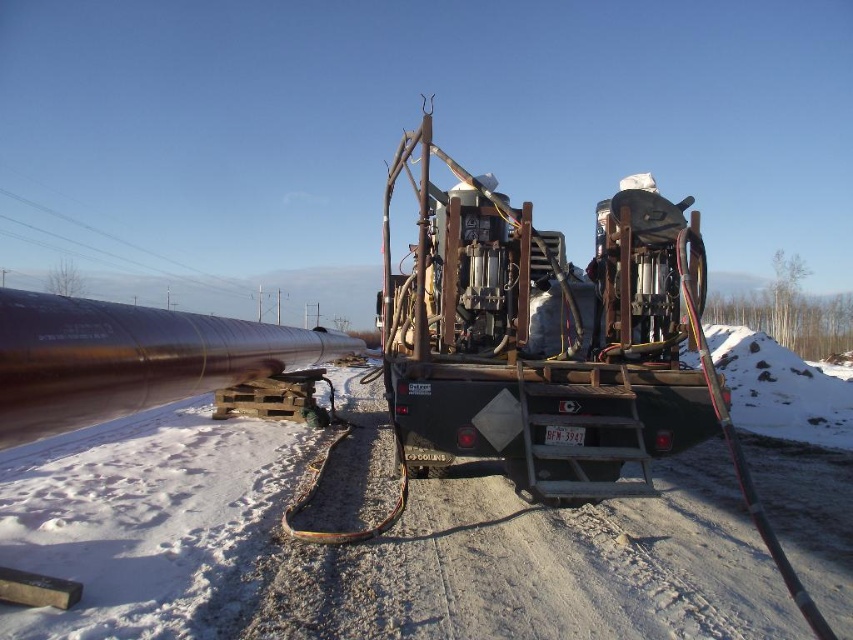
You are a delivery driver who needs to unload a package from your metallic brown trailer truck at center onto the white powdery snow at center. The package requires a minimum of 12 feet of clearance to safely land. Based on the scene, can you safely unload the package?

The white powdery snow at center is 10.67 feet away from the metallic brown trailer truck at center. Since the required clearance is 12 feet, the distance is insufficient for safe unloading. You should move the truck or find another location with enough space.

You are standing at the origin point of the coordinate system. You want to walk to the white powdery snow at center. Which direction should you move in?

Since the white powdery snow at center is located at coordinate point (366,547), you should move towards the right and slightly forward to reach it.